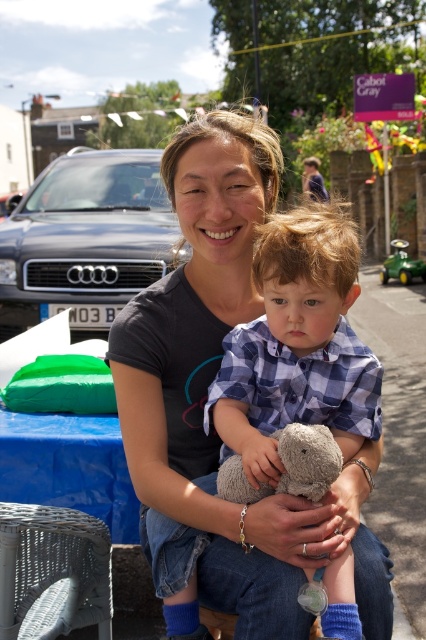
Question: Among these objects, which one is nearest to the camera?

Choices:
 (A) blue checkered shirt at center
 (B) fuzzy gray teddy bear at center
 (C) green plastic toy car at right

Answer: (B)

Question: Which point is farther to the camera?

Choices:
 (A) fuzzy gray teddy bear at center
 (B) green plastic toy car at right

Answer: (B)

Question: Considering the relative positions of blue checkered shirt at center and green plastic toy car at right in the image provided, where is blue checkered shirt at center located with respect to green plastic toy car at right?

Choices:
 (A) below
 (B) above

Answer: (A)

Question: Which point is farther to the camera?

Choices:
 (A) (409, 276)
 (B) (377, 397)

Answer: (A)

Question: Considering the relative positions of fuzzy gray teddy bear at center and green plastic toy car at right in the image provided, where is fuzzy gray teddy bear at center located with respect to green plastic toy car at right?

Choices:
 (A) below
 (B) above

Answer: (A)

Question: Does blue checkered shirt at center appear on the left side of fuzzy gray teddy bear at center?

Choices:
 (A) yes
 (B) no

Answer: (B)